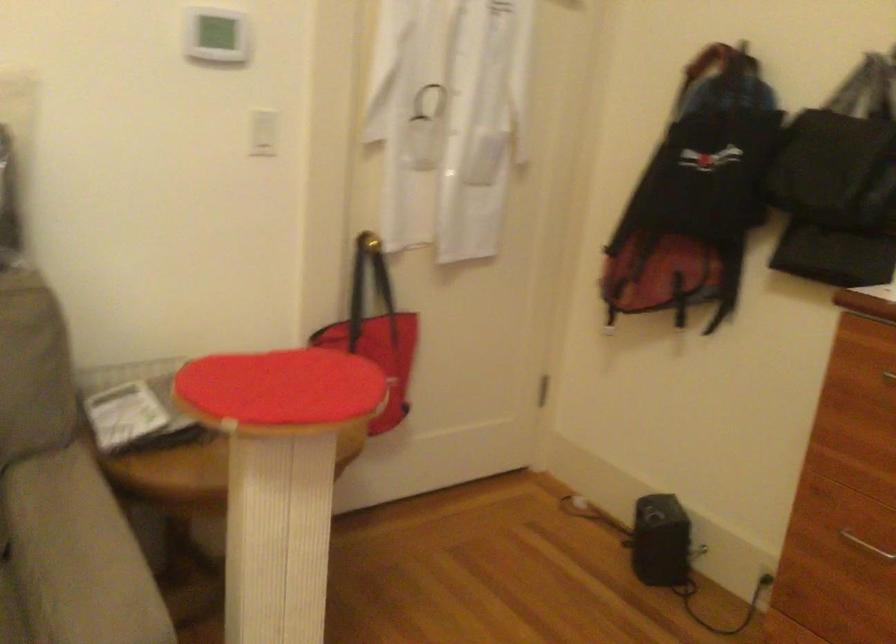
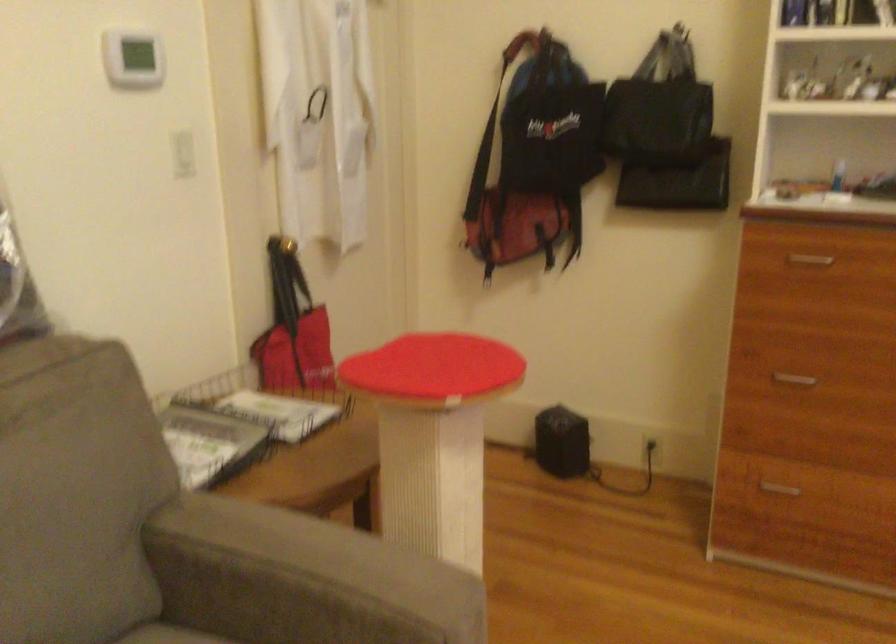
Question: The images are taken continuously from a first-person perspective. In which direction is your viewpoint rotating?

Choices:
 (A) Left
 (B) Right
 (C) Up
 (D) Down

Answer: (B)